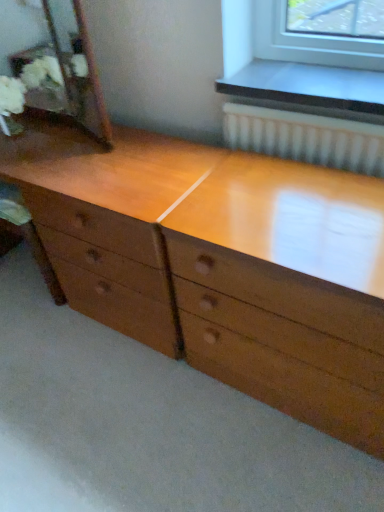
Measure the distance between point [131,287] and camera.

Point [131,287] is 4.57 feet from camera.

The image size is (384, 512). Describe the element at coordinates (201, 272) in the screenshot. I see `light brown wood chest of drawers at center` at that location.

The width and height of the screenshot is (384, 512). I want to click on light brown wood chest of drawers at center, so click(x=201, y=272).

Measure the distance between light brown wood chest of drawers at center and camera.

light brown wood chest of drawers at center is 34.33 inches away from camera.

This screenshot has width=384, height=512. What do you see at coordinates (67, 70) in the screenshot?
I see `wooden mirror at left` at bounding box center [67, 70].

The width and height of the screenshot is (384, 512). I want to click on wooden mirror at left, so click(67, 70).

Where is `light brown wood chest of drawers at center`? This screenshot has width=384, height=512. light brown wood chest of drawers at center is located at coordinates (201, 272).

Is light brown wood chest of drawers at center to the right of wooden mirror at left from the viewer's perspective?

Correct, you'll find light brown wood chest of drawers at center to the right of wooden mirror at left.

Considering the relative positions of light brown wood chest of drawers at center and wooden mirror at left in the image provided, is light brown wood chest of drawers at center in front of wooden mirror at left?

Yes.

Which point is more forward, (371, 434) or (56, 97)?

The point (371, 434) is more forward.

From the image's perspective, is light brown wood chest of drawers at center positioned above or below wooden mirror at left?

light brown wood chest of drawers at center is below wooden mirror at left.

From a real-world perspective, is light brown wood chest of drawers at center physically located above or below wooden mirror at left?

Clearly, from a real-world perspective, light brown wood chest of drawers at center is below wooden mirror at left.

Considering the sizes of objects light brown wood chest of drawers at center and wooden mirror at left in the image provided, who is wider, light brown wood chest of drawers at center or wooden mirror at left?

Wider between the two is light brown wood chest of drawers at center.

Between light brown wood chest of drawers at center and wooden mirror at left, which one has more height?

light brown wood chest of drawers at center.

Is light brown wood chest of drawers at center bigger than wooden mirror at left?

Yes, light brown wood chest of drawers at center is bigger than wooden mirror at left.

Is light brown wood chest of drawers at center surrounding wooden mirror at left?

No, wooden mirror at left is not inside light brown wood chest of drawers at center.

Is light brown wood chest of drawers at center far from wooden mirror at left?

No, light brown wood chest of drawers at center is not far from wooden mirror at left.

Is light brown wood chest of drawers at center oriented away from wooden mirror at left?

No.

How many degrees apart are the facing directions of light brown wood chest of drawers at center and wooden mirror at left?

There is a 0.324-degree angle between the facing directions of light brown wood chest of drawers at center and wooden mirror at left.

The image size is (384, 512). In the image, there is a wooden mirror at left. Identify the location of the chest of drawers below it (from the image's perspective). pyautogui.click(x=201, y=272).

Considering the relative positions of wooden mirror at left and light brown wood chest of drawers at center in the image provided, is wooden mirror at left to the left or to the right of light brown wood chest of drawers at center?

wooden mirror at left is to the left of light brown wood chest of drawers at center.

From the picture: Considering the positions of objects wooden mirror at left and light brown wood chest of drawers at center in the image provided, who is in front, wooden mirror at left or light brown wood chest of drawers at center?

light brown wood chest of drawers at center is in front.

Considering the positions of points (86, 118) and (176, 261), is point (86, 118) closer to camera compared to point (176, 261)?

No, it is behind (176, 261).

From the image's perspective, is wooden mirror at left located above or below light brown wood chest of drawers at center?

wooden mirror at left is above light brown wood chest of drawers at center.

From a real-world perspective, is wooden mirror at left physically below light brown wood chest of drawers at center?

No, from a real-world perspective, wooden mirror at left is not under light brown wood chest of drawers at center.

Which of these two, wooden mirror at left or light brown wood chest of drawers at center, is thinner?

wooden mirror at left.

Can you confirm if wooden mirror at left is taller than light brown wood chest of drawers at center?

No, wooden mirror at left is not taller than light brown wood chest of drawers at center.

Based on their sizes in the image, would you say wooden mirror at left is bigger or smaller than light brown wood chest of drawers at center?

Clearly, wooden mirror at left is smaller in size than light brown wood chest of drawers at center.

Choose the correct answer: Is wooden mirror at left inside light brown wood chest of drawers at center or outside it?

wooden mirror at left is spatially situated outside light brown wood chest of drawers at center.

Is wooden mirror at left beside light brown wood chest of drawers at center?

No, wooden mirror at left is not in contact with light brown wood chest of drawers at center.

Is wooden mirror at left oriented towards light brown wood chest of drawers at center?

No, wooden mirror at left is not aimed at light brown wood chest of drawers at center.

At what (x,y) coordinates should I click in order to perform the action: click on mirror above the light brown wood chest of drawers at center (from a real-world perspective). Please return your answer as a coordinate pair (x, y). The width and height of the screenshot is (384, 512). Looking at the image, I should click on (67, 70).

The width and height of the screenshot is (384, 512). Find the location of `mirror above the light brown wood chest of drawers at center (from a real-world perspective)`. mirror above the light brown wood chest of drawers at center (from a real-world perspective) is located at coordinates (67, 70).

Identify the location of the chest of drawers that is under the wooden mirror at left (from a real-world perspective). The height and width of the screenshot is (512, 384). (201, 272).